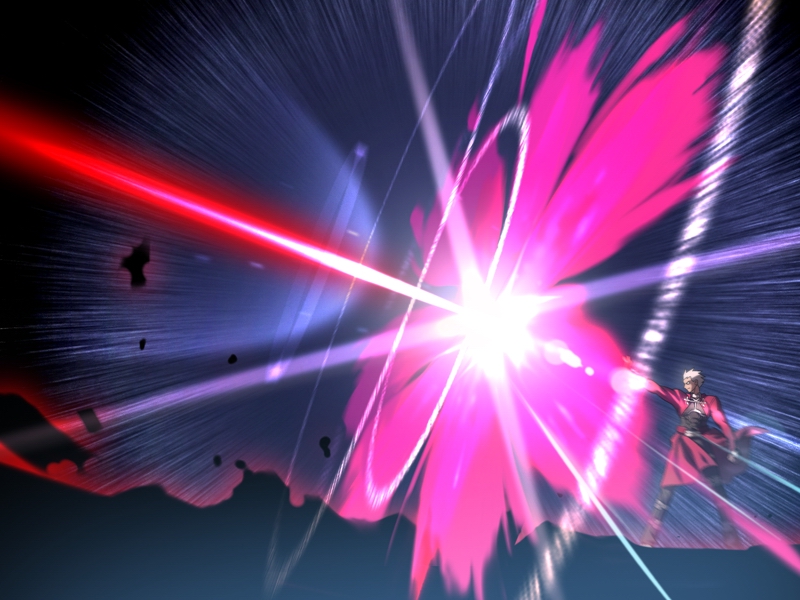
At what (x,y) coordinates should I click in order to perform the action: click on robes. Please return your answer as a coordinate pair (x, y). The width and height of the screenshot is (800, 600). Looking at the image, I should click on (684, 417).